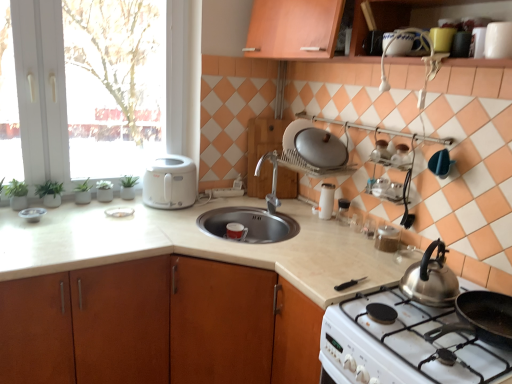
In the scene shown: What is the approximate width of white glossy salt shaker at center, placed as the 1th kitchen appliance when sorted from right to left?

white glossy salt shaker at center, placed as the 1th kitchen appliance when sorted from right to left, is 10.26 centimeters in width.

Where is `metallic silver kettle at upper right, acting as the 3th appliance starting from the right`? metallic silver kettle at upper right, acting as the 3th appliance starting from the right is located at coordinates (381, 151).

What do you see at coordinates (321, 148) in the screenshot?
I see `satin silver lid at upper center, placed as the second kitchen appliance when sorted from left to right` at bounding box center [321, 148].

The image size is (512, 384). In order to click on white glossy window at upper left in this screenshot , I will do `click(41, 90)`.

Is silver metallic faucet at center wider or thinner than metallic silver kettle at upper right, which is the second appliance from top to bottom?

silver metallic faucet at center is wider than metallic silver kettle at upper right, which is the second appliance from top to bottom.

From the image's perspective, is silver metallic faucet at center located above metallic silver kettle at upper right, which appears as the fourth appliance when viewed from the back?

No, from the image's perspective, silver metallic faucet at center is not over metallic silver kettle at upper right, which appears as the fourth appliance when viewed from the back.

Is silver metallic faucet at center facing away from metallic silver kettle at upper right, which appears as the fourth appliance when viewed from the back?

No, metallic silver kettle at upper right, which appears as the fourth appliance when viewed from the back, is not at the back of silver metallic faucet at center.

Is point (280, 202) closer to viewer compared to point (384, 148)?

No.

From the image's perspective, count 2nd kitchen appliances downward from the metallic silver kettle at upper right, the 5th appliance from the bottom, and point to it. Please provide its 2D coordinates.

[(326, 201)]

Is white glossy salt shaker at center, acting as the 3th kitchen appliance starting from the left, bigger or smaller than metallic silver kettle at upper right, which appears as the fourth appliance when viewed from the back?

white glossy salt shaker at center, acting as the 3th kitchen appliance starting from the left, is bigger than metallic silver kettle at upper right, which appears as the fourth appliance when viewed from the back.

Between clear glass salt and pepper shakers at center, the 6th appliance positioned from the front, and white glossy coffee cup at upper right, placed as the 6th appliance when sorted from left to right, which one has larger size?

white glossy coffee cup at upper right, placed as the 6th appliance when sorted from left to right, is bigger.

This screenshot has height=384, width=512. What are the coordinates of `the 3rd appliance below the white glossy coffee cup at upper right, the 6th appliance viewed from the back (from the image's perspective)` in the screenshot? It's located at (343, 211).

From the image's perspective, who appears lower, clear glass salt and pepper shakers at center, the 1th appliance in the back-to-front sequence, or white glossy coffee cup at upper right, which ranks as the sixth appliance in bottom-to-top order?

clear glass salt and pepper shakers at center, the 1th appliance in the back-to-front sequence.

Is point (343, 224) closer to camera compared to point (495, 39)?

No, (343, 224) is further to viewer.

From a real-world perspective, between white glossy salt shaker at center, placed as the 1th kitchen appliance when sorted from right to left, and white glossy plate at left, acting as the fourth appliance starting from the bottom, who is vertically higher?

From a 3D spatial view, white glossy salt shaker at center, placed as the 1th kitchen appliance when sorted from right to left, is above.

Would you say white glossy salt shaker at center, acting as the 3th kitchen appliance starting from the left, is to the left or to the right of white glossy plate at left, the second appliance positioned from the back, in the picture?

A: Clearly, white glossy salt shaker at center, acting as the 3th kitchen appliance starting from the left, is on the right of white glossy plate at left, the second appliance positioned from the back, in the image.

Relative to white glossy plate at left, the 3th appliance viewed from the top, is white glossy salt shaker at center, acting as the 3th kitchen appliance starting from the left, in front or behind?

white glossy salt shaker at center, acting as the 3th kitchen appliance starting from the left, is behind white glossy plate at left, the 3th appliance viewed from the top.

Measure the distance from white glossy salt shaker at center, acting as the 3th kitchen appliance starting from the left, to white glossy plate at left, the 3th appliance viewed from the top.

white glossy salt shaker at center, acting as the 3th kitchen appliance starting from the left, is 97.96 centimeters from white glossy plate at left, the 3th appliance viewed from the top.

Is satin silver lid at upper center, placed as the second kitchen appliance when sorted from left to right, located within clear glass salt and pepper shakers at center, marked as the third appliance in a left-to-right arrangement?

No, satin silver lid at upper center, placed as the second kitchen appliance when sorted from left to right, is not a part of clear glass salt and pepper shakers at center, marked as the third appliance in a left-to-right arrangement.

Which of these two, clear glass salt and pepper shakers at center, the 4th appliance in the right-to-left sequence, or satin silver lid at upper center, which is counted as the second kitchen appliance, starting from the right, stands shorter?

Standing shorter between the two is clear glass salt and pepper shakers at center, the 4th appliance in the right-to-left sequence.

From a real-world perspective, is clear glass salt and pepper shakers at center, the 6th appliance positioned from the front, under satin silver lid at upper center, placed as the second kitchen appliance when sorted from left to right?

Yes, from a real-world perspective, clear glass salt and pepper shakers at center, the 6th appliance positioned from the front, is below satin silver lid at upper center, placed as the second kitchen appliance when sorted from left to right.

Between wooden cutting board at center and green matte plant at left, which one has smaller size?

green matte plant at left.

From the picture: From the image's perspective, is wooden cutting board at center positioned above or below green matte plant at left?

wooden cutting board at center is situated higher than green matte plant at left in the image.

Considering the sizes of objects wooden cutting board at center and green matte plant at left in the image provided, who is wider, wooden cutting board at center or green matte plant at left?

With larger width is wooden cutting board at center.

In the image, is wooden cutting board at center positioned in front of or behind green matte plant at left?

Visually, wooden cutting board at center is located behind green matte plant at left.

How far apart are metallic silver bowl at left, the third appliance in the back-to-front sequence, and white glossy plate at left, the second appliance positioned from the back?

A distance of 33.56 centimeters exists between metallic silver bowl at left, the third appliance in the back-to-front sequence, and white glossy plate at left, the second appliance positioned from the back.

Does metallic silver bowl at left, the sixth appliance positioned from the right, touch white glossy plate at left, the 3th appliance viewed from the top?

There is a gap between metallic silver bowl at left, the sixth appliance positioned from the right, and white glossy plate at left, the 3th appliance viewed from the top.

Is metallic silver bowl at left, the fifth appliance viewed from the top, outside of white glossy plate at left, which is the second appliance from left to right?

Absolutely, metallic silver bowl at left, the fifth appliance viewed from the top, is external to white glossy plate at left, which is the second appliance from left to right.

Which object is wider, metallic silver bowl at left, the 4th appliance from the front, or white glossy plate at left, acting as the 5th appliance starting from the front?

white glossy plate at left, acting as the 5th appliance starting from the front.

You are a GUI agent. You are given a task and a screenshot of the screen. Output one action in this format:
    pyautogui.click(x=<x>, y=<y>)
    Task: Click on the 1st appliance above the silver metallic faucet at center (from the image's perspective)
    The height and width of the screenshot is (384, 512).
    Given the screenshot: What is the action you would take?
    pyautogui.click(x=381, y=151)

Starting from the white glossy salt shaker at center, placed as the 1th kitchen appliance when sorted from right to left, which appliance is the 2nd one to the right? Please provide its 2D coordinates.

[(381, 151)]

Which object lies further to the anchor point white plastic toaster at left, which is the third kitchen appliance in right-to-left order, metallic silver bowl at left, the 4th appliance from the front, or white glossy countertop at center?

The object further to white plastic toaster at left, which is the third kitchen appliance in right-to-left order, is metallic silver bowl at left, the 4th appliance from the front.

Which object lies further to the anchor point white glossy salt shaker at center, placed as the 1th kitchen appliance when sorted from right to left, satin silver lid at upper center, which is counted as the second kitchen appliance, starting from the right, or white glossy countertop at center?

Based on the image, white glossy countertop at center appears to be further to white glossy salt shaker at center, placed as the 1th kitchen appliance when sorted from right to left.

Estimate the real-world distances between objects in this image. Which object is closer to white glossy gas stove at lower right, silver metallic faucet at center or metallic silver bowl at left, the third appliance in the back-to-front sequence?

Based on the image, silver metallic faucet at center appears to be nearer to white glossy gas stove at lower right.

Considering their positions, is wooden cutting board at center positioned further to white glossy window at upper left than white plastic toaster at left, placed as the first kitchen appliance when sorted from left to right?

wooden cutting board at center.

Estimate the real-world distances between objects in this image. Which object is closer to wooden cutting board at center, metallic silver bowl at left, arranged as the 2th appliance when ordered from the bottom, or satin silver lid at upper center, placed as the second kitchen appliance when sorted from left to right?

satin silver lid at upper center, placed as the second kitchen appliance when sorted from left to right.

Looking at the image, which one is located closer to wooden cutting board at center, green matte plant at left or clear glass jar at upper right, the 2th appliance in the front-to-back sequence?

Based on the image, clear glass jar at upper right, the 2th appliance in the front-to-back sequence, appears to be nearer to wooden cutting board at center.

Estimate the real-world distances between objects in this image. Which object is further from wooden cutting board at center, white glossy salt shaker at center, acting as the 3th kitchen appliance starting from the left, or green matte plant at left?

Among the two, green matte plant at left is located further to wooden cutting board at center.

Considering their positions, is white glossy coffee cup at upper right, the 6th appliance viewed from the back, positioned closer to white glossy gas stove at lower right than metallic silver kettle at upper right, acting as the 3th appliance starting from the right?

Among the two, metallic silver kettle at upper right, acting as the 3th appliance starting from the right, is located nearer to white glossy gas stove at lower right.

The width and height of the screenshot is (512, 384). In order to click on window between metallic silver bowl at left, the sixth appliance positioned from the right, and white glossy gas stove at lower right from left to right in this screenshot , I will do 41,90.

Find the location of `kitchen appliance between green matte plant at left and wooden cutting board at center from left to right`. kitchen appliance between green matte plant at left and wooden cutting board at center from left to right is located at coordinates (169, 182).

Where is `gas stove between white glossy countertop at center and white glossy salt shaker at center, acting as the 3th kitchen appliance starting from the left, from front to back`? The image size is (512, 384). gas stove between white glossy countertop at center and white glossy salt shaker at center, acting as the 3th kitchen appliance starting from the left, from front to back is located at coordinates (402, 345).

Identify the location of tap located between white plastic toaster at left, placed as the first kitchen appliance when sorted from left to right, and metallic silver kettle at upper right, which appears as the fourth appliance when viewed from the back, in the left-right direction. The width and height of the screenshot is (512, 384). (272, 180).